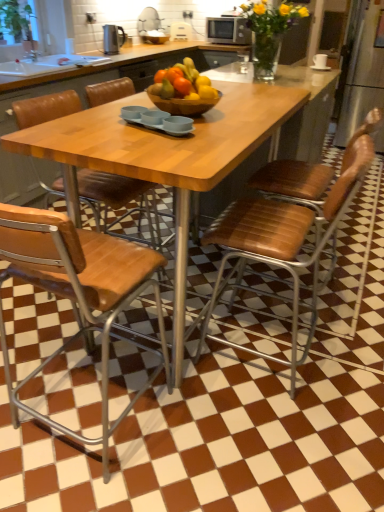
Where is `vacant area that is in front of brown leather chair at center, arranged as the 2th chair when viewed from the right`? vacant area that is in front of brown leather chair at center, arranged as the 2th chair when viewed from the right is located at coordinates (283, 437).